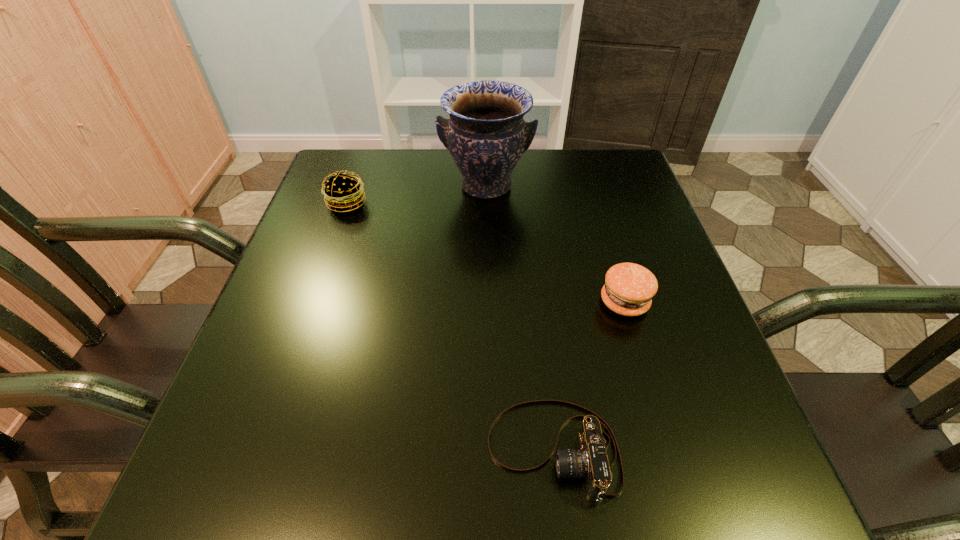
I want to click on pottery, so (486, 135).

The height and width of the screenshot is (540, 960). I want to click on the farther patty, so click(343, 192).

Where is `the leftmost object`? This screenshot has width=960, height=540. the leftmost object is located at coordinates (343, 192).

The height and width of the screenshot is (540, 960). I want to click on the rightmost object, so click(x=629, y=288).

The height and width of the screenshot is (540, 960). What are the coordinates of `the nearer patty` in the screenshot? It's located at tap(629, 288).

I want to click on the shortest object, so click(x=590, y=461).

At what (x,y) coordinates should I click in order to perform the action: click on camera. Please return your answer as a coordinate pair (x, y). Image resolution: width=960 pixels, height=540 pixels. Looking at the image, I should click on (590, 461).

Find the location of `vacant space positioned 0.300m on the front handle of the pottery`. vacant space positioned 0.300m on the front handle of the pottery is located at coordinates (488, 308).

At what (x,y) coordinates should I click in order to perform the action: click on free space located on the right of the left patty. Please return your answer as a coordinate pair (x, y). Looking at the image, I should click on (486, 203).

The width and height of the screenshot is (960, 540). I want to click on blank space located 0.320m on the back of the nearer patty, so click(x=591, y=191).